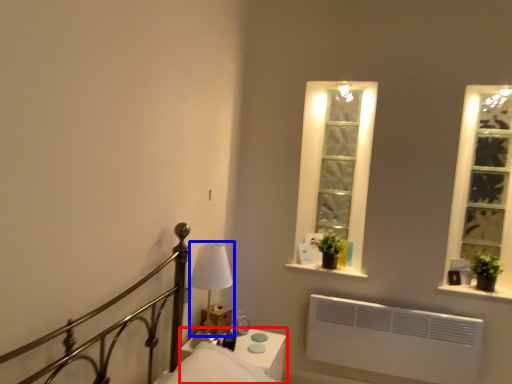
Question: Which point is closer to the camera, nightstand (highlighted by a red box) or bedside lamp (highlighted by a blue box)?

Choices:
 (A) nightstand
 (B) bedside lamp

Answer: (A)